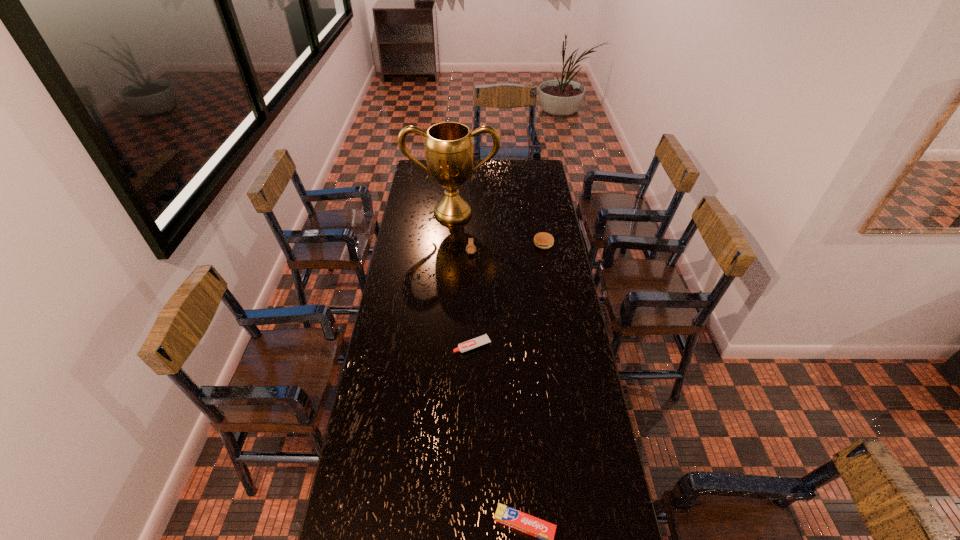
The height and width of the screenshot is (540, 960). I want to click on the farthest object, so click(449, 146).

Where is `trophy cup`? The image size is (960, 540). trophy cup is located at coordinates (449, 146).

Where is `the fourth shortest object`? The image size is (960, 540). the fourth shortest object is located at coordinates (470, 248).

The height and width of the screenshot is (540, 960). In order to click on the third shortest object in this screenshot , I will do `click(543, 240)`.

Locate an element on the screen. Image resolution: width=960 pixels, height=540 pixels. patty is located at coordinates (543, 240).

At what (x,y) coordinates should I click in order to perform the action: click on the farther toothpaste. Please return your answer as a coordinate pair (x, y). The height and width of the screenshot is (540, 960). Looking at the image, I should click on (484, 339).

Locate an element on the screen. free space located on the surface of the trophy cup with symbols is located at coordinates (450, 248).

The width and height of the screenshot is (960, 540). I want to click on vacant region located on the face of the fourth shortest object, so click(470, 295).

At what (x,y) coordinates should I click in order to perform the action: click on vacant space positioned 0.240m on the back of the third tallest object. Please return your answer as a coordinate pair (x, y). Looking at the image, I should click on (538, 209).

Locate an element on the screen. Image resolution: width=960 pixels, height=540 pixels. vacant area situated 0.180m on the left of the second nearest object is located at coordinates (407, 346).